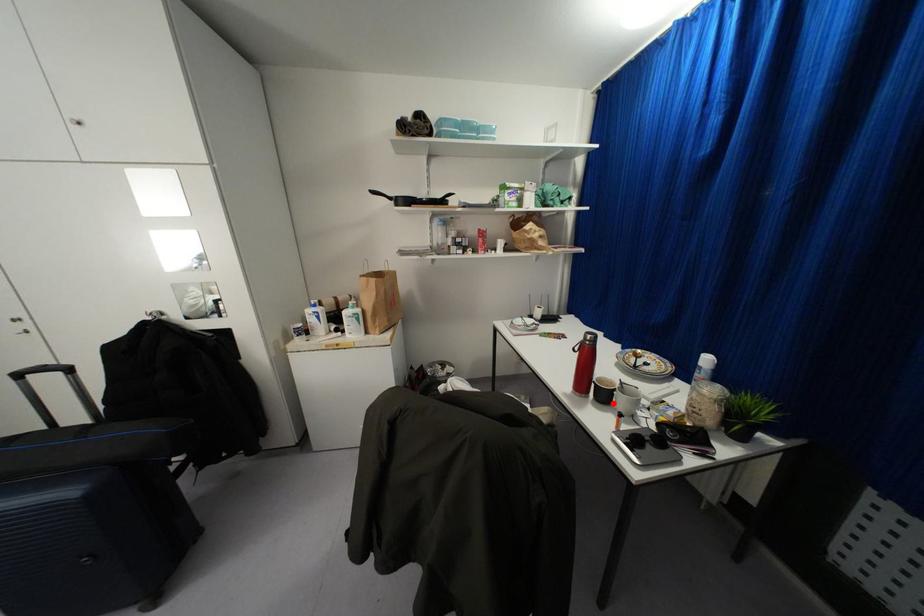
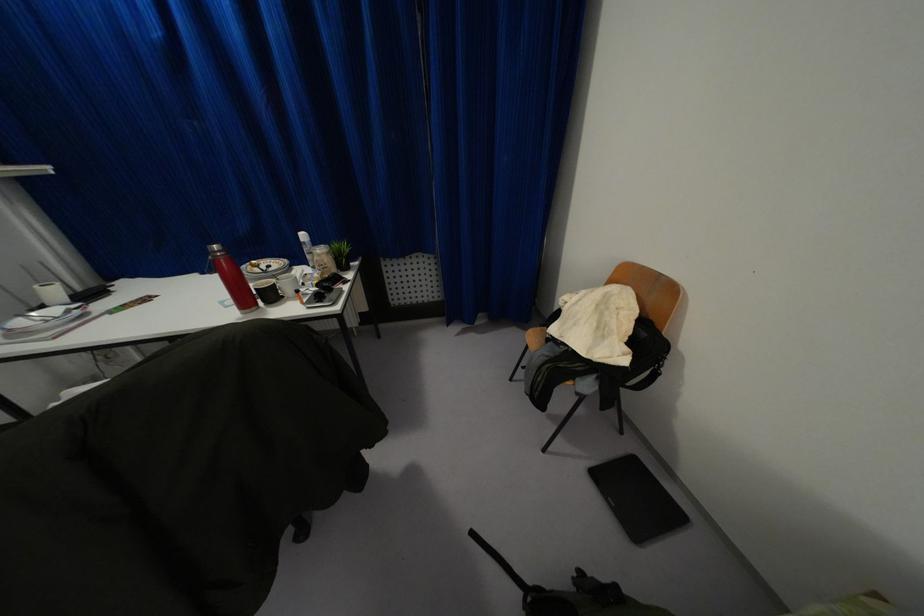
The point at the highlighted location is marked in the first image. Where is the corresponding point in the second image?

(282, 296)